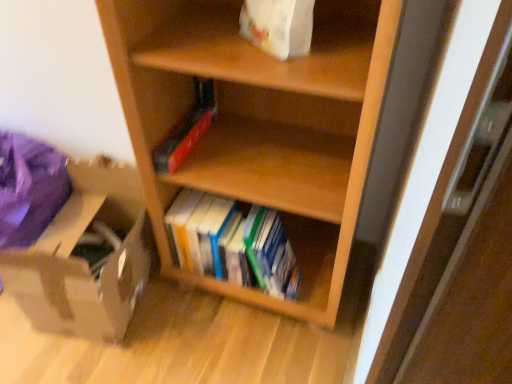
I want to click on vacant area to the right of brown cardboard box at lower left, so click(198, 327).